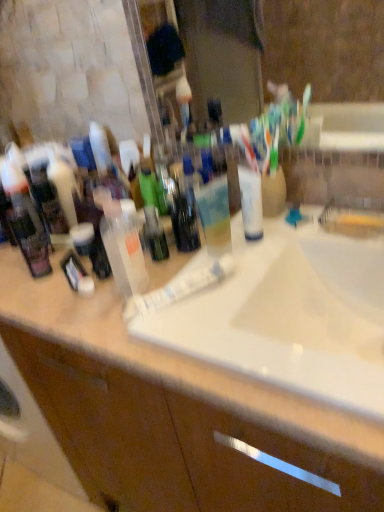
Question: Is black matte toothbrush at left, the third toiletry when ordered from right to left, turned away from translucent plastic bottle at center?

Choices:
 (A) yes
 (B) no

Answer: (A)

Question: Does black matte toothbrush at left, marked as the third toiletry in a left-to-right arrangement, have a lesser height compared to translucent plastic bottle at center?

Choices:
 (A) yes
 (B) no

Answer: (A)

Question: Does black matte toothbrush at left, the third toiletry when ordered from right to left, have a greater width compared to translucent plastic bottle at center?

Choices:
 (A) yes
 (B) no

Answer: (B)

Question: Considering the relative sizes of black matte toothbrush at left, marked as the third toiletry in a left-to-right arrangement, and translucent plastic bottle at center in the image provided, is black matte toothbrush at left, marked as the third toiletry in a left-to-right arrangement, thinner than translucent plastic bottle at center?

Choices:
 (A) yes
 (B) no

Answer: (A)

Question: Is black matte toothbrush at left, marked as the third toiletry in a left-to-right arrangement, smaller than translucent plastic bottle at center?

Choices:
 (A) yes
 (B) no

Answer: (A)

Question: Considering the positions of point (150, 227) and point (87, 286), is point (150, 227) closer or farther from the camera than point (87, 286)?

Choices:
 (A) farther
 (B) closer

Answer: (A)

Question: Is translucent plastic bottle at center, the first toiletry from the right, situated inside black matte toothbrush at left, marked as the third toiletry in a left-to-right arrangement, or outside?

Choices:
 (A) inside
 (B) outside

Answer: (B)

Question: From the image's perspective, is translucent plastic bottle at center, the first toiletry from the right, positioned above or below black matte toothbrush at left, the third toiletry when ordered from right to left?

Choices:
 (A) above
 (B) below

Answer: (A)

Question: Relative to black matte toothbrush at left, marked as the third toiletry in a left-to-right arrangement, is translucent plastic bottle at center, the 5th toiletry from the left, in front or behind?

Choices:
 (A) front
 (B) behind

Answer: (B)

Question: In the image, is translucent plastic bottle at center, the first toiletry from the right, on the left side or the right side of white matte jar at center-left, the second toiletry viewed from the right?

Choices:
 (A) left
 (B) right

Answer: (B)

Question: From a real-world perspective, is translucent plastic bottle at center, the 5th toiletry from the left, positioned above or below white matte jar at center-left, the second toiletry viewed from the right?

Choices:
 (A) below
 (B) above

Answer: (B)

Question: Considering the positions of point (160, 243) and point (82, 223), is point (160, 243) closer or farther from the camera than point (82, 223)?

Choices:
 (A) closer
 (B) farther

Answer: (A)

Question: In the image, is translucent plastic bottle at center, the 5th toiletry from the left, positioned in front of or behind white matte jar at center-left, positioned as the fourth toiletry in left-to-right order?

Choices:
 (A) behind
 (B) front

Answer: (B)

Question: Is white matte jar at center-left, the second toiletry viewed from the right, in front of or behind matte black lotion at center, arranged as the 5th toiletry when viewed from the right, in the image?

Choices:
 (A) front
 (B) behind

Answer: (A)

Question: From the image's perspective, relative to matte black lotion at center, arranged as the 1th toiletry when viewed from the left, is white matte jar at center-left, the second toiletry viewed from the right, above or below?

Choices:
 (A) above
 (B) below

Answer: (B)